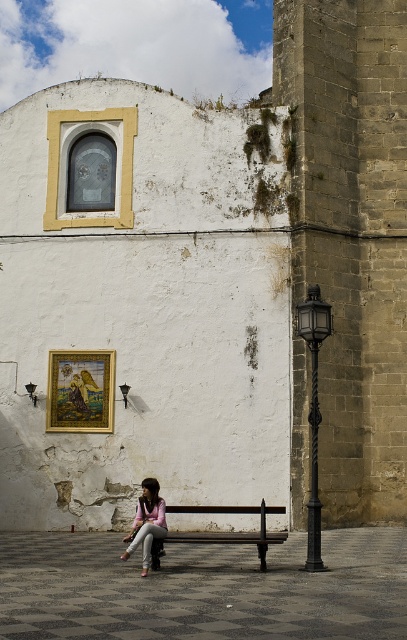
Question: Can you confirm if black wrought iron streetlight at right is thinner than pink fabric jacket at lower center?

Choices:
 (A) yes
 (B) no

Answer: (A)

Question: Can you confirm if wooden bench at center is positioned above pink fabric jacket at lower center?

Choices:
 (A) no
 (B) yes

Answer: (A)

Question: Which point is closer to the camera taking this photo?

Choices:
 (A) (304, 326)
 (B) (284, 540)
 (C) (144, 536)

Answer: (C)

Question: Which object appears farthest from the camera in this image?

Choices:
 (A) pink fabric jacket at lower center
 (B) black wrought iron streetlight at right
 (C) wooden bench at center

Answer: (B)

Question: Estimate the real-world distances between objects in this image. Which object is farther from the black wrought iron streetlight at right?

Choices:
 (A) pink fabric jacket at lower center
 (B) wooden bench at center

Answer: (A)

Question: Is black wrought iron streetlight at right further to camera compared to pink fabric jacket at lower center?

Choices:
 (A) no
 (B) yes

Answer: (B)